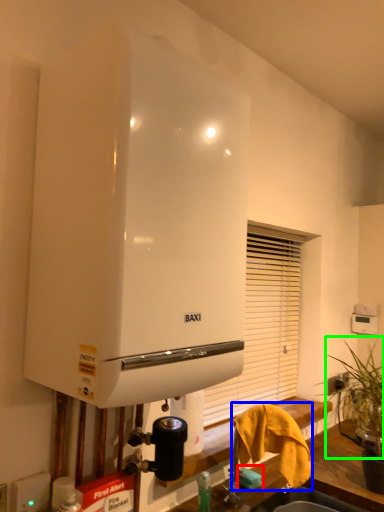
Question: Considering the real-world distances, which object is closest to soap (highlighted by a red box)? bath towel (highlighted by a blue box) or plant (highlighted by a green box).

Choices:
 (A) bath towel
 (B) plant

Answer: (A)